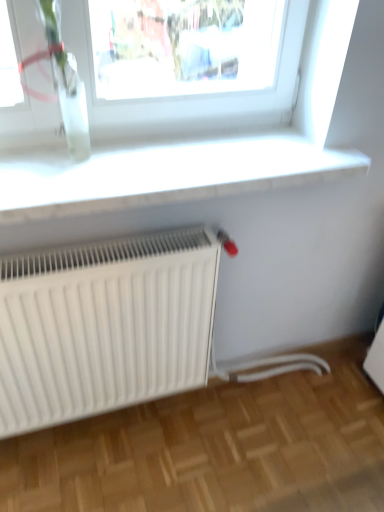
The height and width of the screenshot is (512, 384). Describe the element at coordinates (163, 174) in the screenshot. I see `white smooth window sill at upper center` at that location.

What do you see at coordinates (104, 325) in the screenshot?
I see `white matte radiator at lower left` at bounding box center [104, 325].

Where is `clear glass vase at upper left`? This screenshot has height=512, width=384. clear glass vase at upper left is located at coordinates (66, 82).

You are a GUI agent. You are given a task and a screenshot of the screen. Output one action in this format:
    pyautogui.click(x=<x>, y=<y>)
    Task: Click on the radiator on the right side of clear glass vase at upper left
    The width and height of the screenshot is (384, 512).
    Given the screenshot: What is the action you would take?
    pyautogui.click(x=104, y=325)

Considering the positions of objects clear glass vase at upper left and white matte radiator at lower left in the image provided, who is more to the left, clear glass vase at upper left or white matte radiator at lower left?

clear glass vase at upper left is more to the left.

From the image's perspective, is clear glass vase at upper left below white matte radiator at lower left?

No.

In terms of width, does clear glass vase at upper left look wider or thinner when compared to white matte radiator at lower left?

clear glass vase at upper left is thinner than white matte radiator at lower left.

Considering the points (101, 272) and (64, 116), which point is behind, point (101, 272) or point (64, 116)?

The point (64, 116) is behind.

Would you say white matte radiator at lower left is inside or outside clear glass vase at upper left?

white matte radiator at lower left is not inside clear glass vase at upper left, it's outside.

Based on their sizes in the image, would you say white matte radiator at lower left is bigger or smaller than clear glass vase at upper left?

white matte radiator at lower left is bigger than clear glass vase at upper left.

From the image's perspective, is white smooth window sill at upper center above or below clear glass vase at upper left?

white smooth window sill at upper center is situated lower than clear glass vase at upper left in the image.

Between white smooth window sill at upper center and clear glass vase at upper left, which one has smaller size?

clear glass vase at upper left is smaller.

Does white smooth window sill at upper center have a lesser height compared to clear glass vase at upper left?

Correct, white smooth window sill at upper center is not as tall as clear glass vase at upper left.

From a real-world perspective, is white smooth window sill at upper center under clear glass vase at upper left?

Yes, from a real-world perspective, white smooth window sill at upper center is beneath clear glass vase at upper left.

From the image's perspective, is clear glass vase at upper left on white smooth window sill at upper center?

Yes, from the image's perspective, clear glass vase at upper left is over white smooth window sill at upper center.

Considering the sizes of objects clear glass vase at upper left and white smooth window sill at upper center in the image provided, who is taller, clear glass vase at upper left or white smooth window sill at upper center?

clear glass vase at upper left is taller.

Is white smooth window sill at upper center at the back of clear glass vase at upper left?

No, clear glass vase at upper left's orientation is not away from white smooth window sill at upper center.

Would you say clear glass vase at upper left contains white smooth window sill at upper center?

Actually, white smooth window sill at upper center is outside clear glass vase at upper left.

Between white smooth window sill at upper center and white matte radiator at lower left, which one appears on the left side from the viewer's perspective?

From the viewer's perspective, white matte radiator at lower left appears more on the left side.

Is white smooth window sill at upper center outside of white matte radiator at lower left?

white smooth window sill at upper center lies outside white matte radiator at lower left's area.

Can you confirm if white smooth window sill at upper center is shorter than white matte radiator at lower left?

Yes, white smooth window sill at upper center is shorter than white matte radiator at lower left.

Measure the distance between white smooth window sill at upper center and white matte radiator at lower left.

white smooth window sill at upper center is 13.25 inches away from white matte radiator at lower left.

Which object is thinner, white matte radiator at lower left or white smooth window sill at upper center?

white matte radiator at lower left.

Does white matte radiator at lower left have a smaller size compared to white smooth window sill at upper center?

Incorrect, white matte radiator at lower left is not smaller in size than white smooth window sill at upper center.

Can we say white matte radiator at lower left lies outside white smooth window sill at upper center?

white matte radiator at lower left is positioned outside white smooth window sill at upper center.

Can you confirm if white matte radiator at lower left is shorter than white smooth window sill at upper center?

Incorrect, the height of white matte radiator at lower left does not fall short of that of white smooth window sill at upper center.

Where is `radiator located below the clear glass vase at upper left (from the image's perspective)`? This screenshot has height=512, width=384. radiator located below the clear glass vase at upper left (from the image's perspective) is located at coordinates (104, 325).

Locate an element on the screen. Image resolution: width=384 pixels, height=512 pixels. plant that is above the white matte radiator at lower left (from a real-world perspective) is located at coordinates (66, 82).

In the scene shown: Estimate the real-world distances between objects in this image. Which object is closer to white smooth window sill at upper center, white matte radiator at lower left or clear glass vase at upper left?

Among the two, clear glass vase at upper left is located nearer to white smooth window sill at upper center.

Considering their positions, is clear glass vase at upper left positioned closer to white matte radiator at lower left than white smooth window sill at upper center?

Based on the image, white smooth window sill at upper center appears to be nearer to white matte radiator at lower left.

Which object lies further to the anchor point white smooth window sill at upper center, clear glass vase at upper left or white matte radiator at lower left?

white matte radiator at lower left lies further to white smooth window sill at upper center than the other object.

Based on their spatial positions, is white matte radiator at lower left or white smooth window sill at upper center closer to clear glass vase at upper left?

The object closer to clear glass vase at upper left is white smooth window sill at upper center.

Looking at the image, which one is located further to clear glass vase at upper left, white smooth window sill at upper center or white matte radiator at lower left?

The object further to clear glass vase at upper left is white matte radiator at lower left.

In the scene shown: Based on their spatial positions, is white smooth window sill at upper center or clear glass vase at upper left further from white matte radiator at lower left?

clear glass vase at upper left lies further to white matte radiator at lower left than the other object.

Where is `window sill between clear glass vase at upper left and white matte radiator at lower left from top to bottom`? The image size is (384, 512). window sill between clear glass vase at upper left and white matte radiator at lower left from top to bottom is located at coordinates (163, 174).